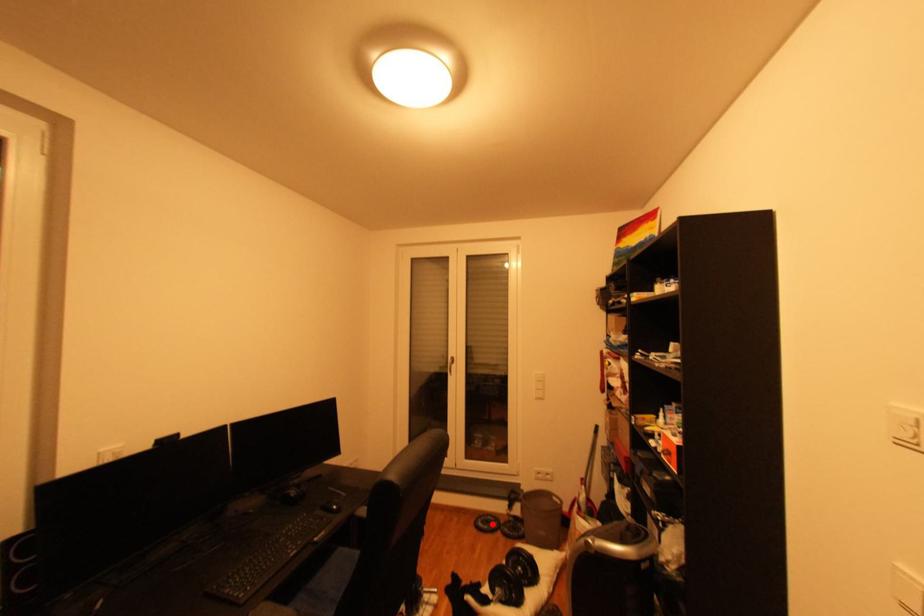
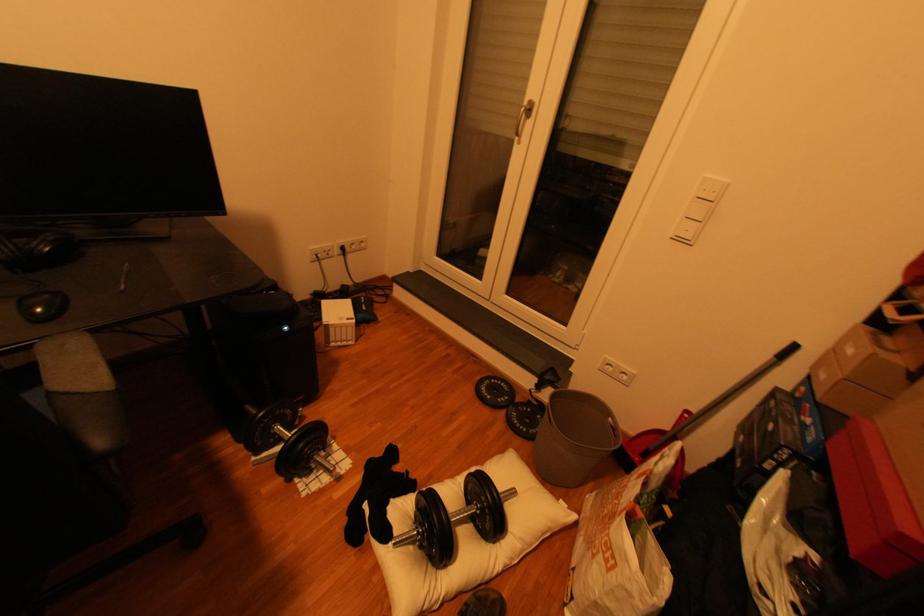
The point at the highlighted location is marked in the first image. Where is the corresponding point in the second image?

(497, 389)